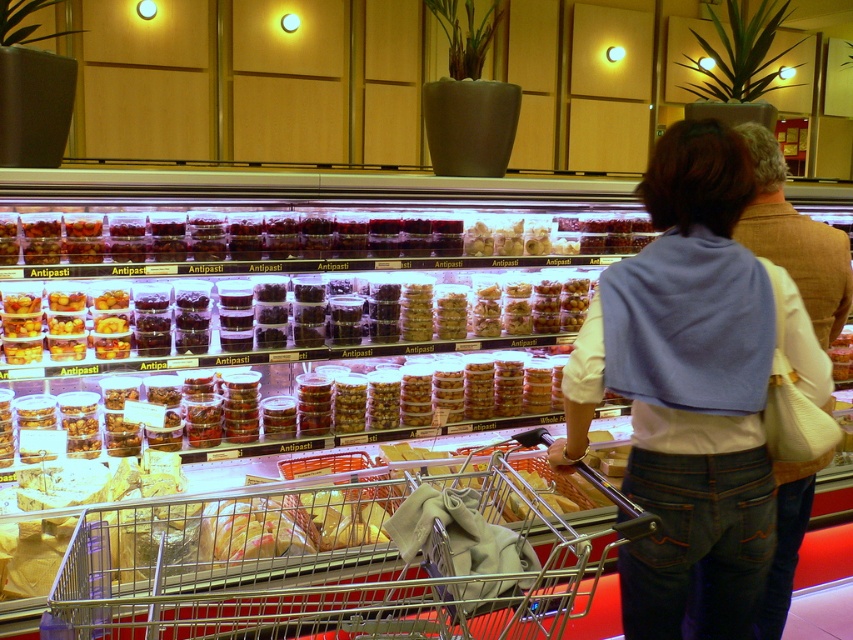
You are a customer in the deli section and want to grab the denim jacket at center from the shopping cart. However, the translucent plastic containers at center are blocking your access. Can you remove the containers to reach the jacket?

The denim jacket at center is positioned under the translucent plastic containers at center, so you need to remove the containers first to access the jacket.

You are trying to decide whether to place a large bag of groceries into the metallic silver shopping cart at center or onto the denim jacket at center. Based on their sizes, which one can accommodate the bag better?

The metallic silver shopping cart at center is wider than the denim jacket at center, so the bag would fit better in the metallic silver shopping cart at center.